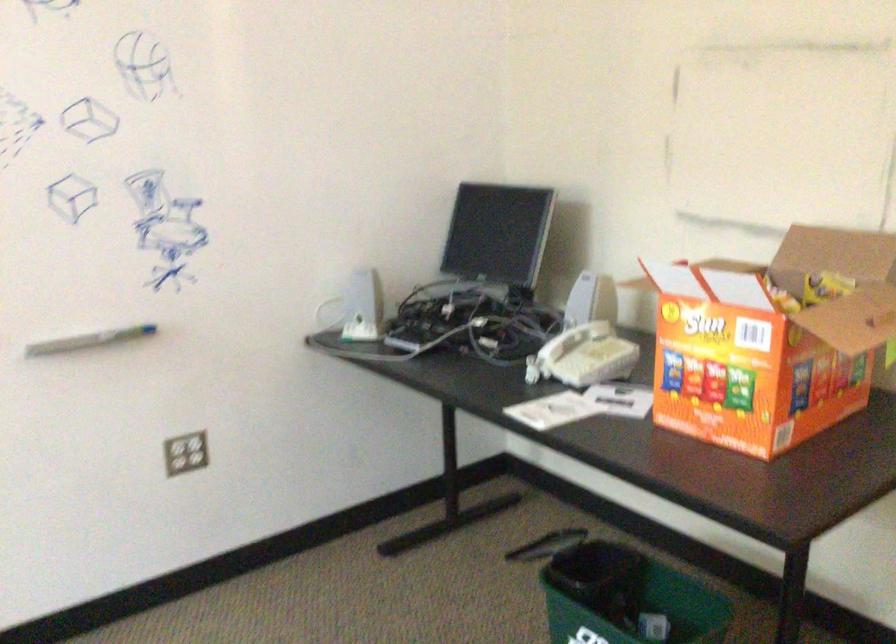
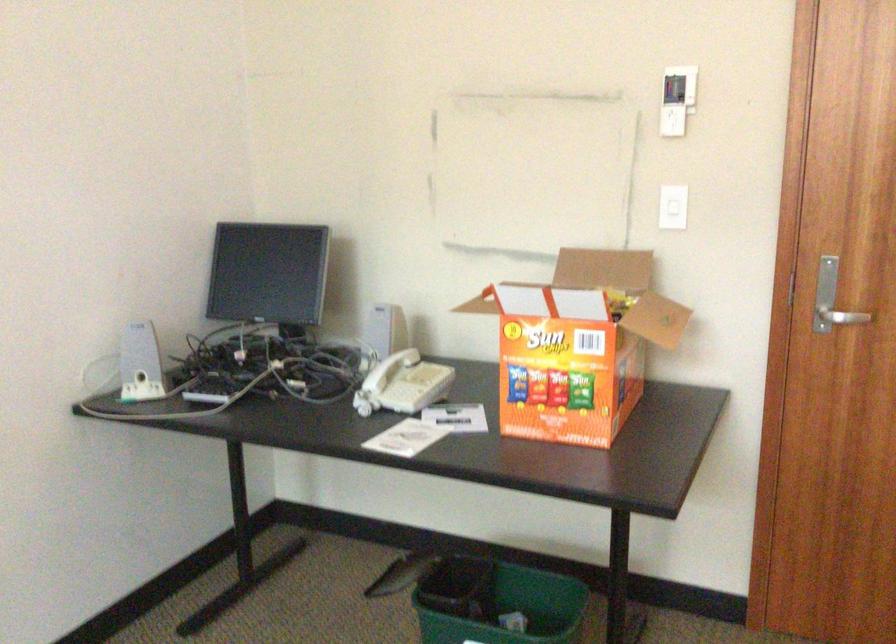
Find the pixel in the second image that matches (x=343, y=308) in the first image.

(140, 363)